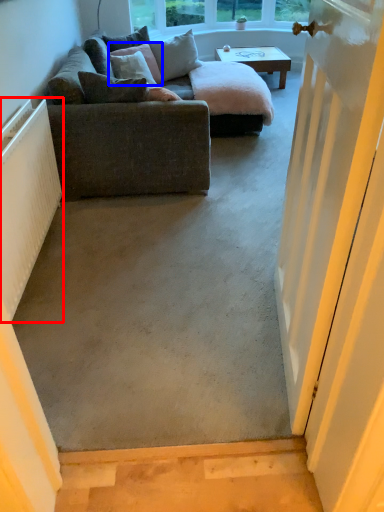
Question: Which object appears farthest to the camera in this image, radiator (highlighted by a red box) or pillow (highlighted by a blue box)?

Choices:
 (A) radiator
 (B) pillow

Answer: (B)